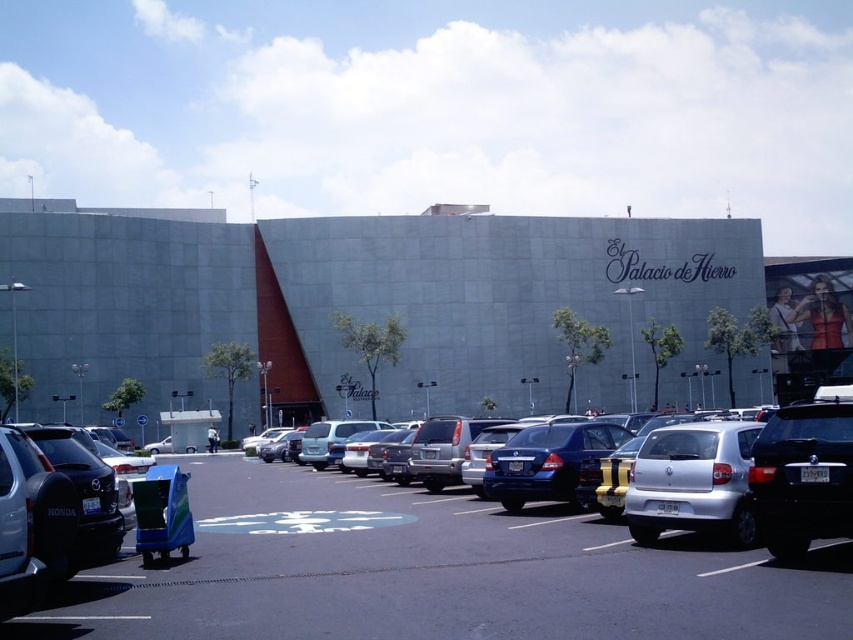
Question: Does smooth asphalt parking lot at center come in front of silver metallic sedan at center?

Choices:
 (A) yes
 (B) no

Answer: (A)

Question: Estimate the real-world distances between objects in this image. Which object is farther from the silver metallic sedan at center?

Choices:
 (A) gray concrete building at center
 (B) smooth asphalt parking lot at center

Answer: (A)

Question: Considering the real-world distances, which object is farthest from the gray concrete building at center?

Choices:
 (A) smooth asphalt parking lot at center
 (B) silver metallic sedan at center

Answer: (A)

Question: Among these objects, which one is farthest from the camera?

Choices:
 (A) smooth asphalt parking lot at center
 (B) gray concrete building at center

Answer: (B)

Question: Is smooth asphalt parking lot at center smaller than silver metallic sedan at center?

Choices:
 (A) no
 (B) yes

Answer: (B)

Question: Can you confirm if gray concrete building at center is bigger than smooth asphalt parking lot at center?

Choices:
 (A) yes
 (B) no

Answer: (A)